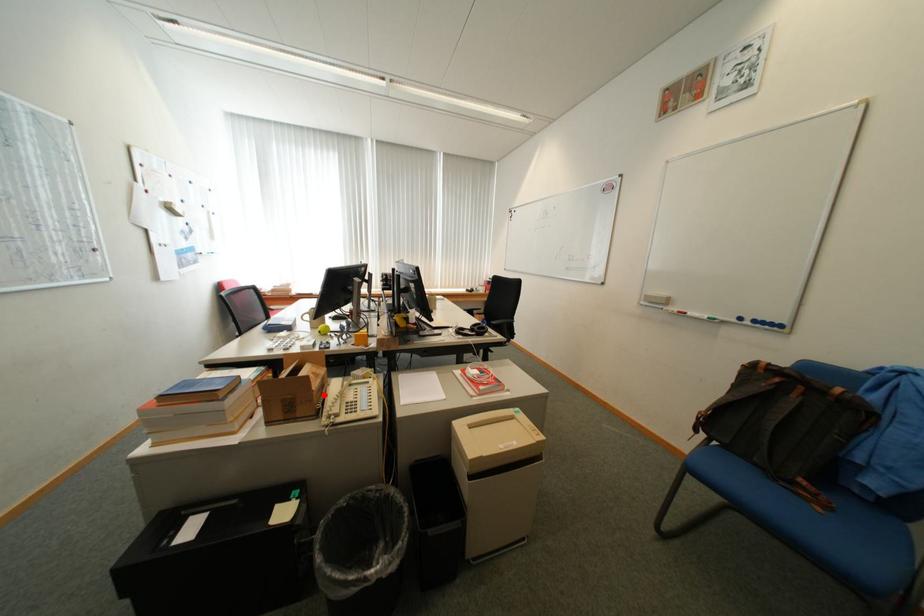
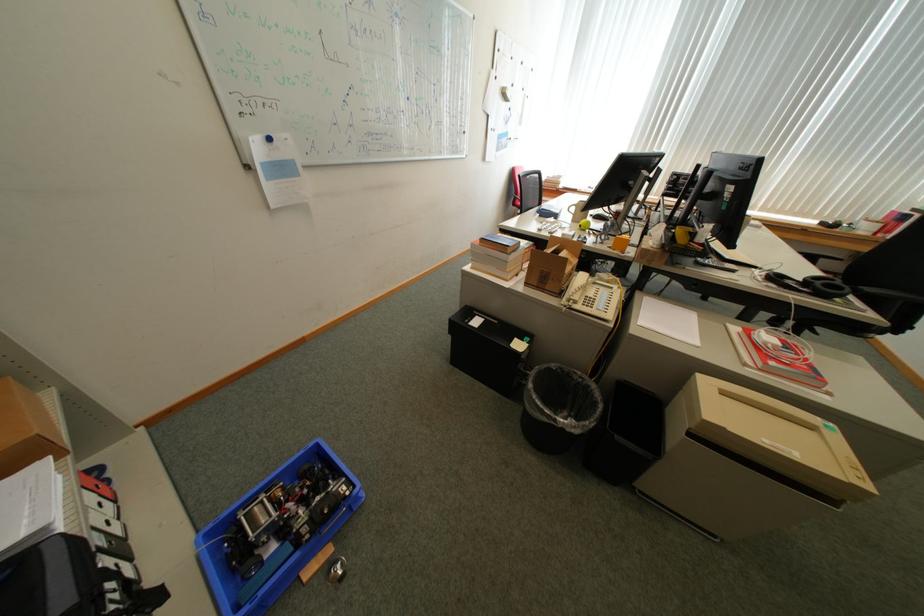
Question: I am providing you with two images of the same scene from different viewpoints. Given a red point in image1, look at the same physical point in image2. Is it:

Choices:
 (A) Closer to the viewpoint
 (B) Farther from the viewpoint

Answer: (A)